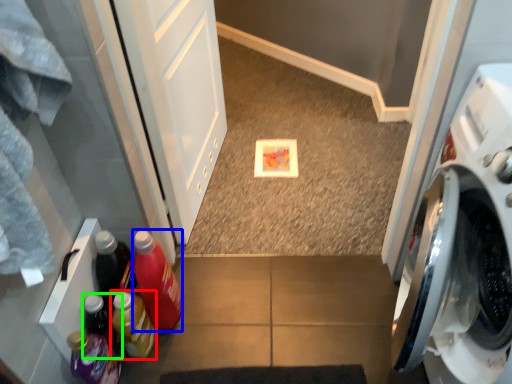
Question: Based on their relative distances, which object is farther from bottle (highlighted by a red box)? Choose from bottle (highlighted by a blue box) and bottle (highlighted by a green box).

Choices:
 (A) bottle
 (B) bottle

Answer: (A)